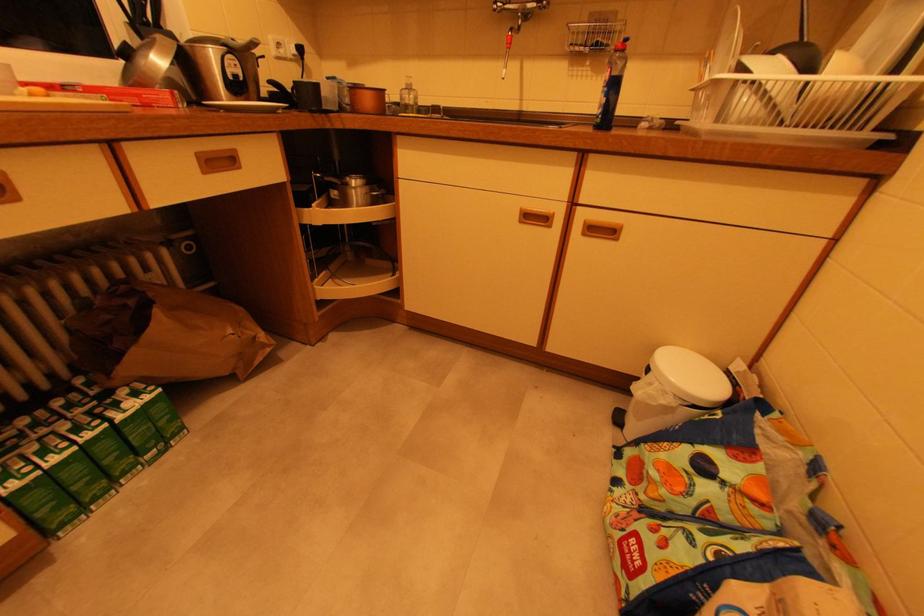
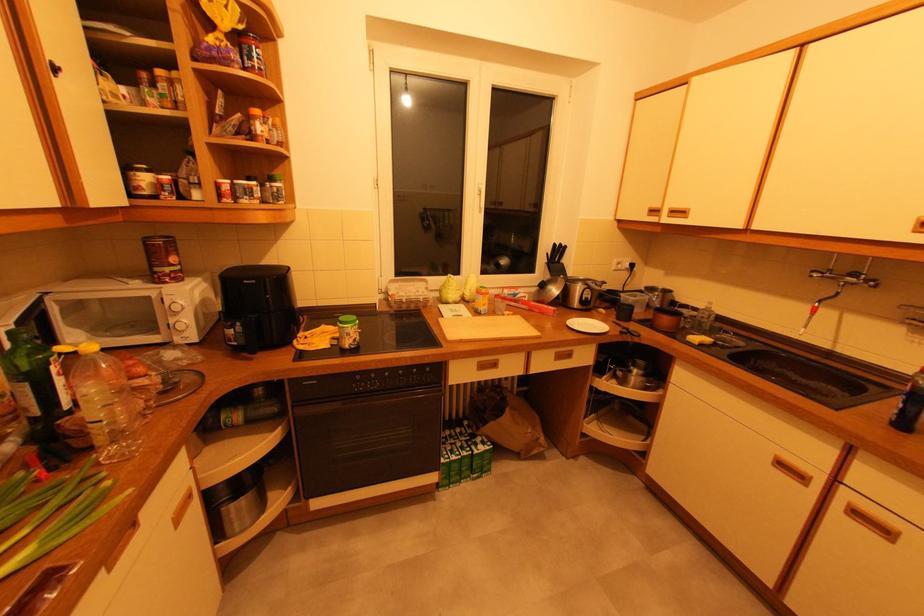
Where in the second image is the point corresponding to point 514,31 from the first image?

(822, 302)